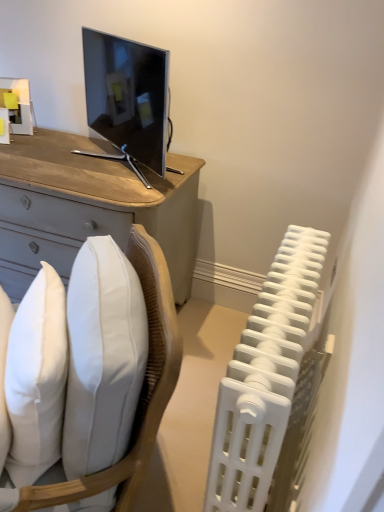
Locate an element on the screen. white plastic radiator at right is located at coordinates (264, 378).

What are the coordinates of `white soft pillow at lower left` in the screenshot? It's located at (37, 378).

Identify the location of white plastic radiator at right. The width and height of the screenshot is (384, 512). (264, 378).

Does white plastic radiator at right touch white soft pillow at lower left?

No.

How distant is white plastic radiator at right from white soft pillow at lower left?

A distance of 19.95 inches exists between white plastic radiator at right and white soft pillow at lower left.

Considering the sizes of objects white plastic radiator at right and white soft pillow at lower left in the image provided, who is thinner, white plastic radiator at right or white soft pillow at lower left?

white plastic radiator at right.

Does white plastic radiator at right have a smaller size compared to white soft pillow at lower left?

No, white plastic radiator at right is not smaller than white soft pillow at lower left.

Are white soft pillow at lower left and white plastic radiator at right located far from each other?

They are positioned close to each other.

In the scene shown: Is white soft pillow at lower left positioned before white plastic radiator at right?

That is False.

From the image's perspective, is white soft pillow at lower left located above or below white plastic radiator at right?

white soft pillow at lower left is above white plastic radiator at right.

Is white soft pillow at lower left to the right of white plastic radiator at right from the viewer's perspective?

Incorrect, white soft pillow at lower left is not on the right side of white plastic radiator at right.

Does point (143, 416) lie behind point (56, 409)?

No, it is in front of (56, 409).

Considering the sizes of white fabric chair at lower left and white soft pillow at lower left in the image, is white fabric chair at lower left taller or shorter than white soft pillow at lower left?

Clearly, white fabric chair at lower left is taller compared to white soft pillow at lower left.

Could white soft pillow at lower left be considered to be inside white fabric chair at lower left?

Indeed, white soft pillow at lower left is located within white fabric chair at lower left.

From a real-world perspective, which object stands above the other?

white fabric chair at lower left.

Can you confirm if white fabric chair at lower left is positioned to the right of white plastic radiator at right?

Incorrect, white fabric chair at lower left is not on the right side of white plastic radiator at right.

Between white fabric chair at lower left and white plastic radiator at right, which one has larger size?

Bigger between the two is white fabric chair at lower left.

Considering the relative sizes of white fabric chair at lower left and white plastic radiator at right in the image provided, is white fabric chair at lower left taller than white plastic radiator at right?

Indeed, white fabric chair at lower left has a greater height compared to white plastic radiator at right.

Considering their positions, is white plastic radiator at right located in front of or behind white fabric chair at lower left?

Clearly, white plastic radiator at right is behind white fabric chair at lower left.

From a real-world perspective, between white plastic radiator at right and white fabric chair at lower left, who is vertically higher?

white fabric chair at lower left, from a real-world perspective.

Is white plastic radiator at right looking in the opposite direction of white fabric chair at lower left?

white plastic radiator at right is not turned away from white fabric chair at lower left.

Based on their positions, is white soft pillow at lower left located to the left or right of white fabric chair at lower left?

white soft pillow at lower left is positioned on white fabric chair at lower left's left side.

Can you tell me how much white soft pillow at lower left and white fabric chair at lower left differ in facing direction?

The angle between the facing direction of white soft pillow at lower left and the facing direction of white fabric chair at lower left is 0.0595 degrees.

Is the position of white soft pillow at lower left more distant than that of white fabric chair at lower left?

Yes, the depth of white soft pillow at lower left is greater than that of white fabric chair at lower left.

Where is `chair in front of the white soft pillow at lower left`? This screenshot has height=512, width=384. chair in front of the white soft pillow at lower left is located at coordinates click(x=141, y=393).

The image size is (384, 512). Identify the location of pillow positioned vertically above the white plastic radiator at right (from a real-world perspective). (37, 378).

Locate an element on the screen. The height and width of the screenshot is (512, 384). pillow that appears behind the white plastic radiator at right is located at coordinates coord(37,378).

Considering their positions, is white soft pillow at lower left positioned further to white plastic radiator at right than white fabric chair at lower left?

The object further to white plastic radiator at right is white soft pillow at lower left.

Consider the image. Estimate the real-world distances between objects in this image. Which object is further from white fabric chair at lower left, white soft pillow at lower left or white plastic radiator at right?

white plastic radiator at right is further to white fabric chair at lower left.

Considering their positions, is white fabric chair at lower left positioned closer to white soft pillow at lower left than white plastic radiator at right?

Among the two, white fabric chair at lower left is located nearer to white soft pillow at lower left.

From the image, which object appears to be nearer to white plastic radiator at right, white fabric chair at lower left or white soft pillow at lower left?

white fabric chair at lower left.

From the image, which object appears to be nearer to white fabric chair at lower left, white plastic radiator at right or white soft pillow at lower left?

Based on the image, white soft pillow at lower left appears to be nearer to white fabric chair at lower left.

Estimate the real-world distances between objects in this image. Which object is further from white soft pillow at lower left, white plastic radiator at right or white fabric chair at lower left?

white plastic radiator at right.

The height and width of the screenshot is (512, 384). I want to click on chair between white soft pillow at lower left and white plastic radiator at right in the horizontal direction, so click(x=141, y=393).